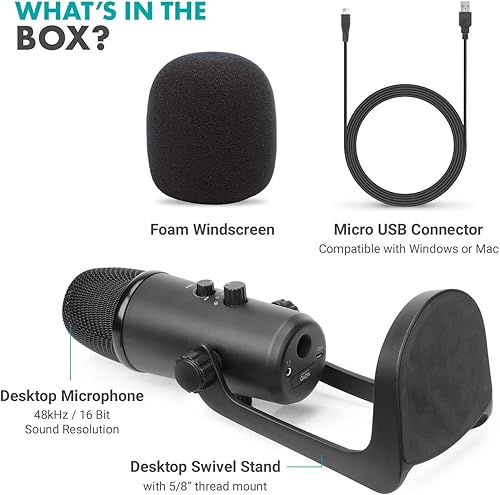
Locate an element on the screen. The image size is (500, 495). foam is located at coordinates (184, 231).